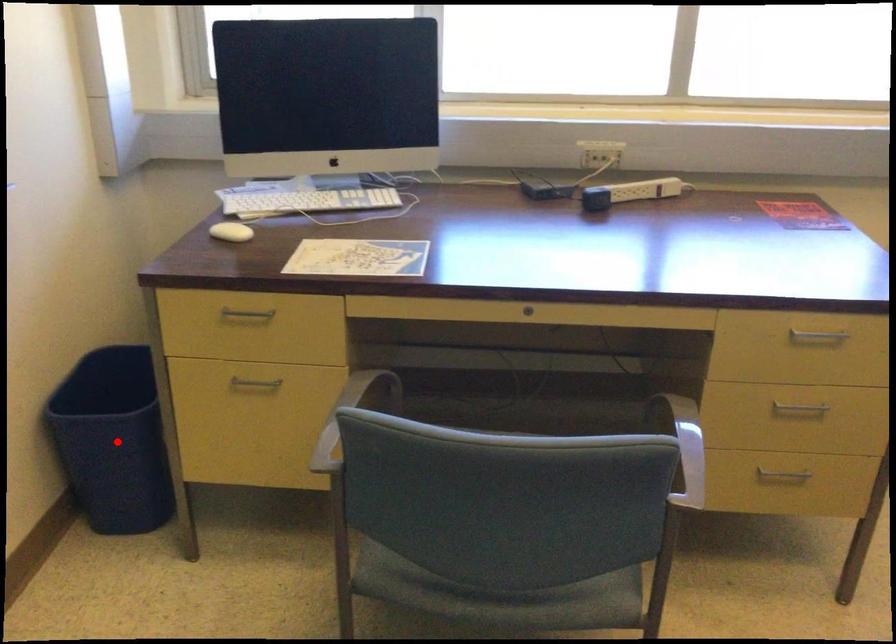
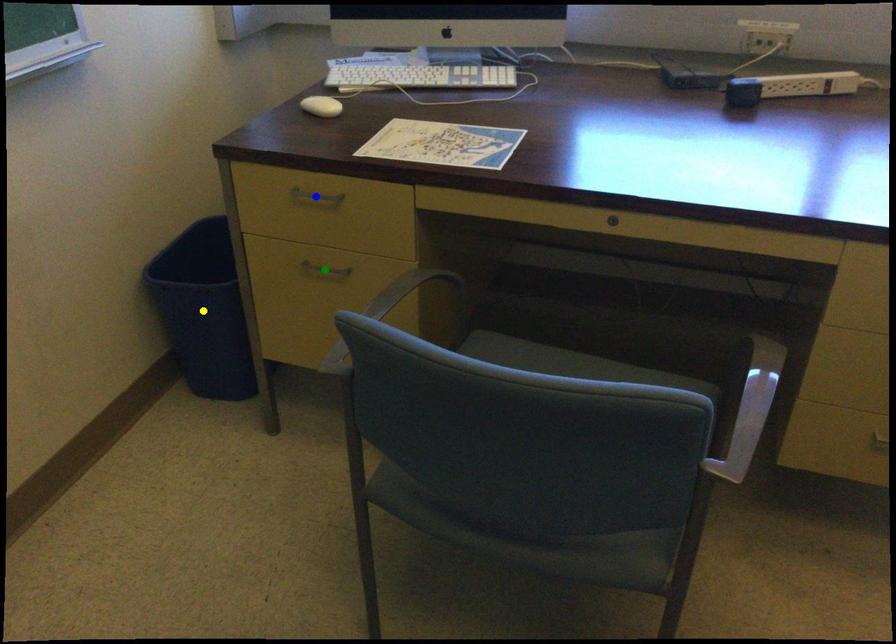
Question: I am providing you with two images of the same scene from different viewpoints. A red point is marked on the first image. You are given multiple points on the second image. Which spot in image 2 lines up with the point in image 1?

Choices:
 (A) green point
 (B) yellow point
 (C) blue point

Answer: (B)